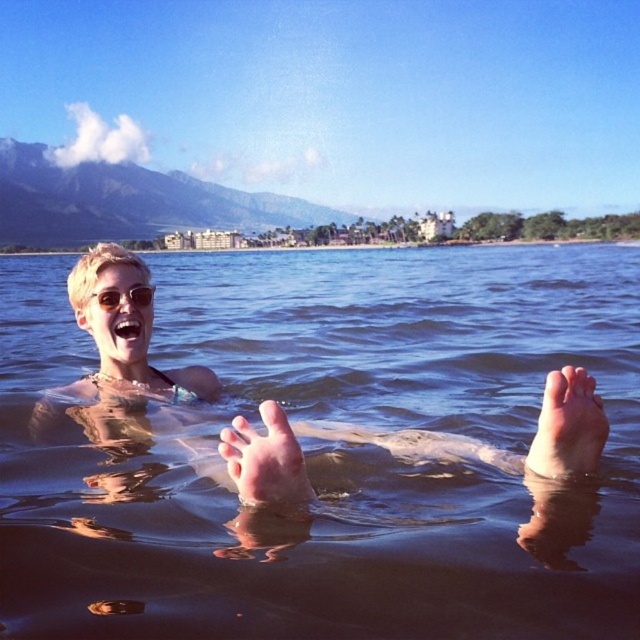
Does pink flesh at lower right have a larger size compared to pink flesh at center?

Yes, pink flesh at lower right is bigger than pink flesh at center.

Who is more distant from viewer, [548,424] or [275,433]?

The point [548,424] is more distant.

Where is `pink flesh at lower right`? pink flesh at lower right is located at coordinates (566, 426).

Can you confirm if pink flesh at center is taller than shiny silver sunglasses at upper center?

Indeed, pink flesh at center has a greater height compared to shiny silver sunglasses at upper center.

Measure the distance between point (220,449) and camera.

3.50 meters

Who is more forward, [288,461] or [100,296]?

Point [288,461] is in front.

Find the location of a particular element. The width and height of the screenshot is (640, 640). pink flesh at center is located at coordinates (266, 460).

Which is above, clear water at feet center or pink flesh at lower right?

clear water at feet center is above.

This screenshot has height=640, width=640. Describe the element at coordinates (326, 451) in the screenshot. I see `clear water at feet center` at that location.

Is point (346, 608) more distant than point (556, 445)?

No.

Locate an element on the screen. The height and width of the screenshot is (640, 640). clear water at feet center is located at coordinates (326, 451).